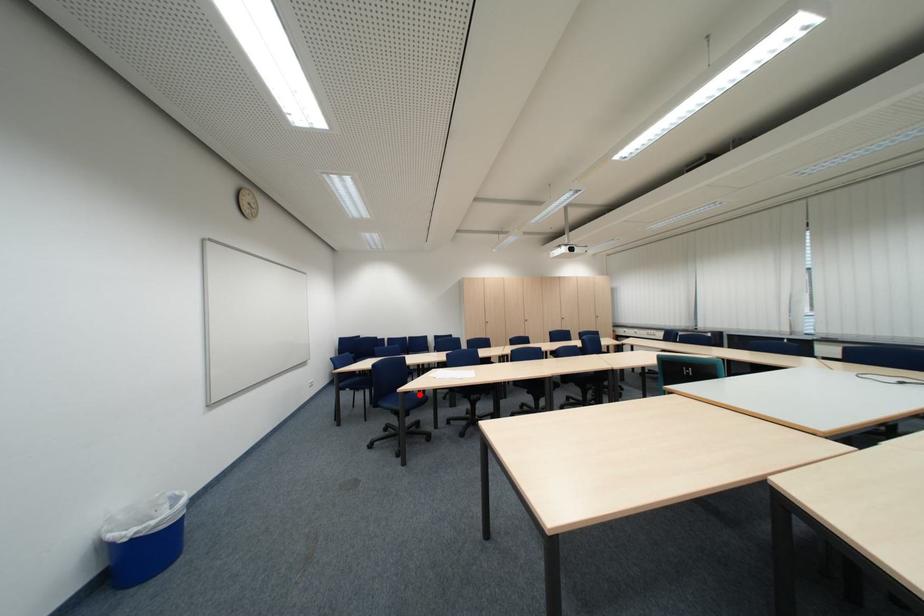
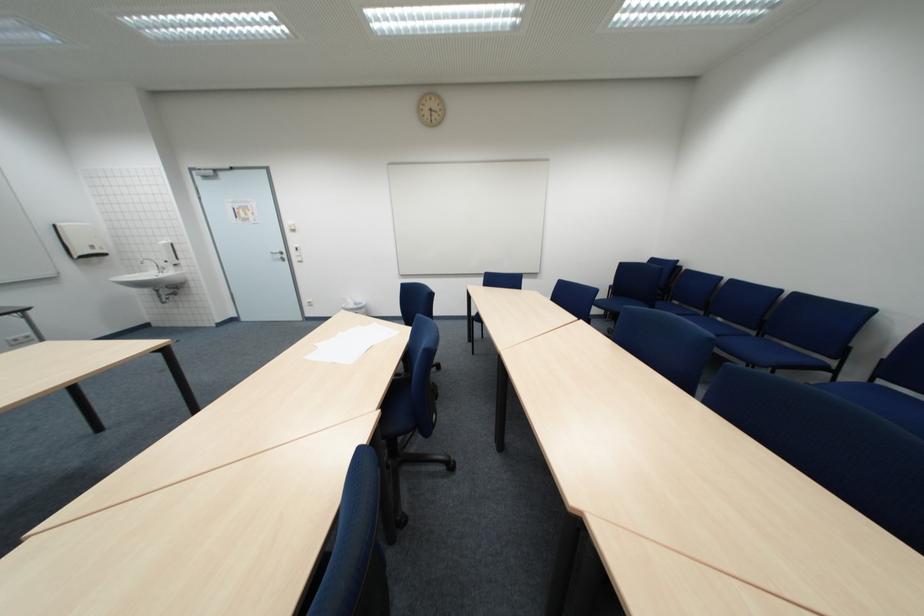
Question: I am providing you with two images of the same scene from different viewpoints. A red point is marked on the first image. Can you still see the location of the red point in image 2?

Choices:
 (A) Yes
 (B) No

Answer: (B)